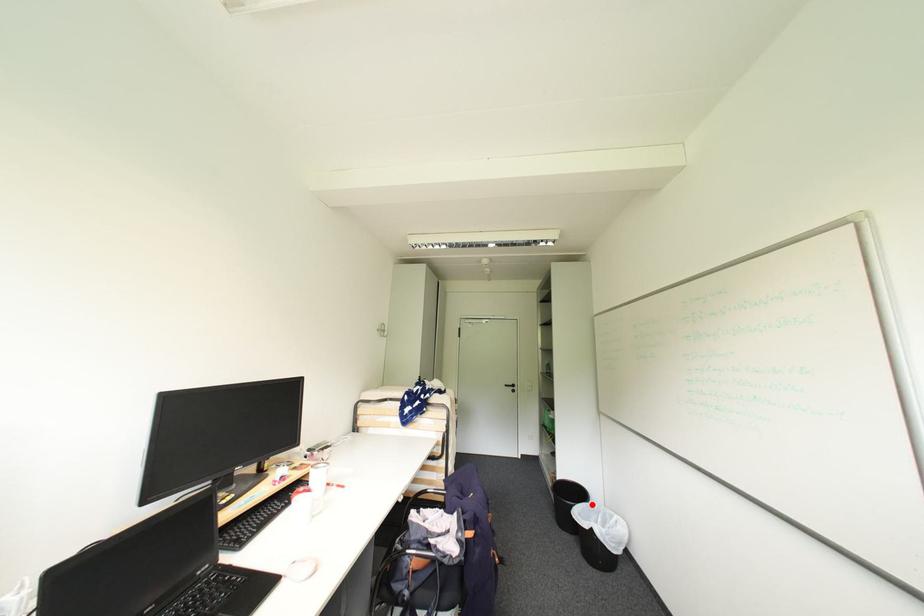
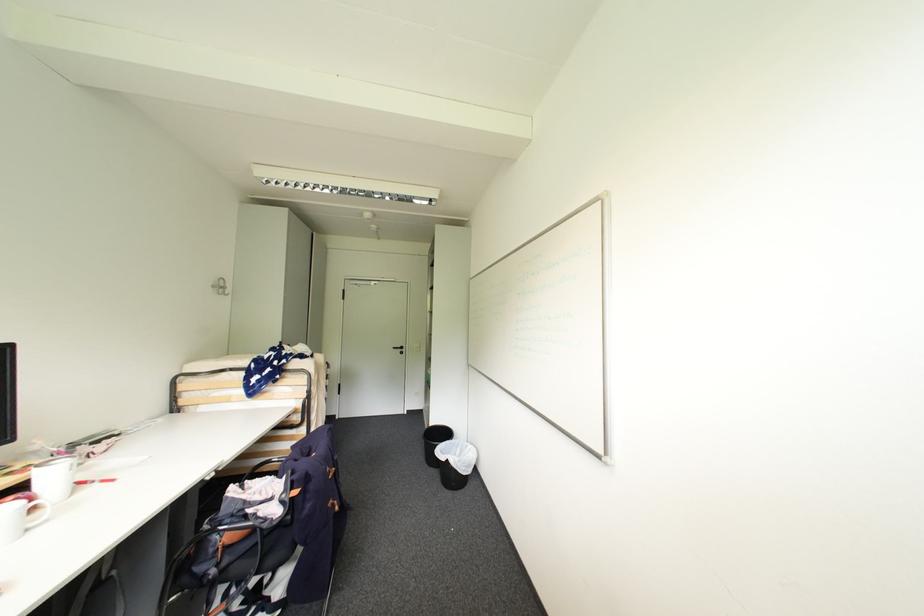
Locate, in the second image, the point that corresponds to the highlighted location in the first image.

(456, 442)